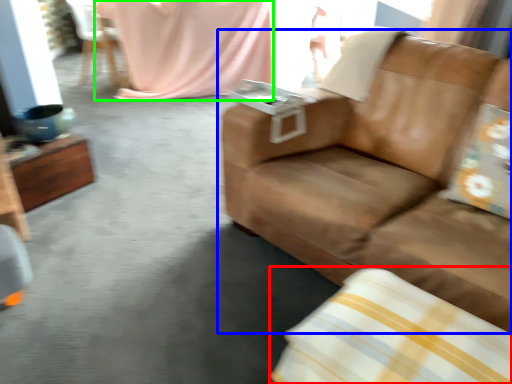
Question: Which object is positioned closest to pillow (highlighted by a red box)? Select from studio couch (highlighted by a blue box) and blanket (highlighted by a green box).

Choices:
 (A) studio couch
 (B) blanket

Answer: (A)